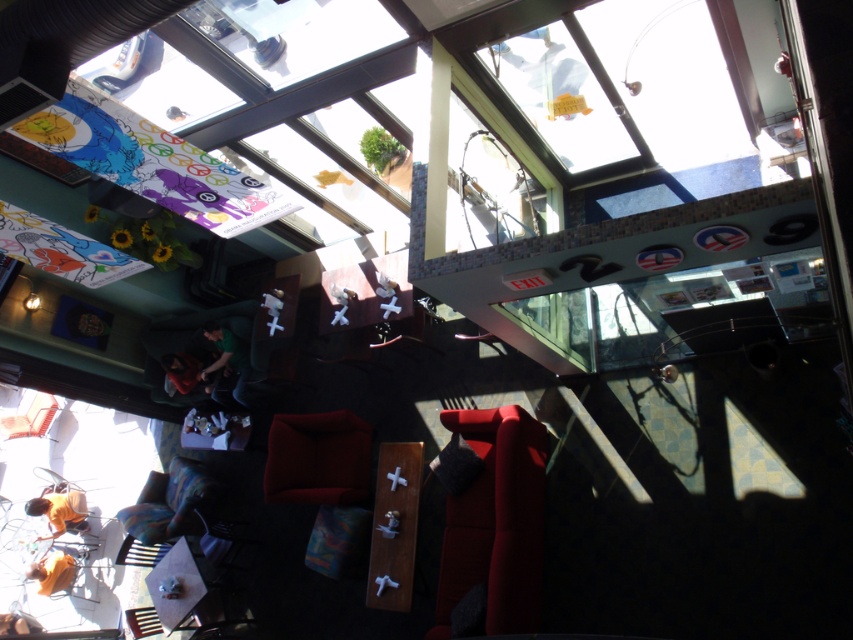
Question: Does matte black shirt at lower left have a lesser width compared to orange shirt at lower left?

Choices:
 (A) no
 (B) yes

Answer: (A)

Question: Is matte orange chair at lower left thinner than matte black shirt at lower left?

Choices:
 (A) no
 (B) yes

Answer: (A)

Question: Among these points, which one is farthest from the camera?

Choices:
 (A) (181, 388)
 (B) (213, 326)
 (C) (38, 592)
 (D) (172, 488)

Answer: (C)

Question: Which point is farther from the camera taking this photo?

Choices:
 (A) pos(55,570)
 (B) pos(289,481)
 (C) pos(231,365)

Answer: (A)

Question: Among these points, which one is farthest from the camera?

Choices:
 (A) (242, 352)
 (B) (38, 413)
 (C) (283, 435)
 (D) (537, 541)

Answer: (B)

Question: Is matte red chair at center in front of multicolored fabric chair at lower left?

Choices:
 (A) yes
 (B) no

Answer: (A)